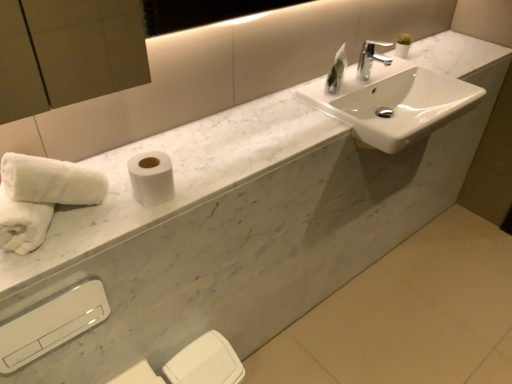
Question: Considering the positions of white glossy sink at upper right and white glossy hand dryer at lower left in the image, is white glossy sink at upper right bigger or smaller than white glossy hand dryer at lower left?

Choices:
 (A) small
 (B) big

Answer: (B)

Question: Is white glossy sink at upper right taller or shorter than white glossy hand dryer at lower left?

Choices:
 (A) tall
 (B) short

Answer: (B)

Question: Which of these objects is positioned farthest from the white matte toilet paper at center, positioned as the 1th toilet paper in front-to-back order?

Choices:
 (A) white fluffy towels at lower left
 (B) white glossy sink at upper right
 (C) white glossy hand dryer at lower left
 (D) chrome metallic faucet at upper center
 (E) white matte toilet paper at lower center, marked as the second toilet paper in a front-to-back arrangement

Answer: (D)

Question: Which of these objects is positioned farthest from the white matte toilet paper at lower center, placed as the 1th toilet paper when sorted from bottom to top?

Choices:
 (A) chrome metallic faucet at upper center
 (B) white matte toilet paper at center, which appears as the 2th toilet paper when viewed from the back
 (C) green glass vase at upper center
 (D) white fluffy towels at lower left
 (E) white glossy sink at upper right

Answer: (A)